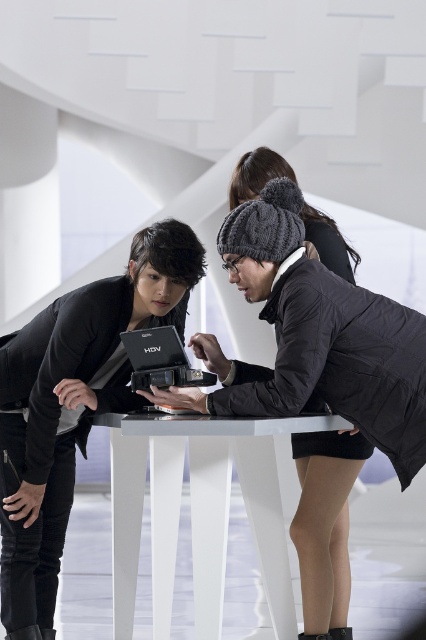
Question: Which object is farther from the camera taking this photo?

Choices:
 (A) black matte laptop at left
 (B) black matte laptop at center
 (C) white glossy table at center

Answer: (B)

Question: Is black matte laptop at left to the left of black matte laptop at center from the viewer's perspective?

Choices:
 (A) yes
 (B) no

Answer: (A)

Question: Where is black matte laptop at left located in relation to black matte laptop at center in the image?

Choices:
 (A) below
 (B) above

Answer: (A)

Question: Which object appears closest to the camera in this image?

Choices:
 (A) black matte laptop at center
 (B) black matte laptop at left

Answer: (B)

Question: Which object is farther from the camera taking this photo?

Choices:
 (A) black matte laptop at center
 (B) black matte laptop at left
 (C) white glossy table at center

Answer: (A)

Question: Can you confirm if black matte laptop at left is bigger than white glossy table at center?

Choices:
 (A) yes
 (B) no

Answer: (B)